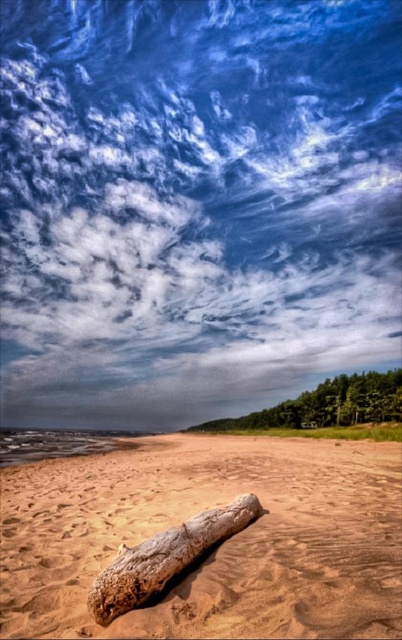
You are a photographer trying to capture the white fluffy cloud at upper center in your shot. The camera is set to focus at point coordinates of 0.320, 0.485. Will the cloud be in focus?

Yes, the white fluffy cloud at upper center is exactly at the focus point coordinates of (x=194, y=204), so it will be in focus.

You are standing on the brown sandy beach at lower center and want to pick up the brown textured log at center. In which direction should you move to reach it?

The brown sandy beach at lower center is to the right of the brown textured log at center, so you should move to the left to reach it.